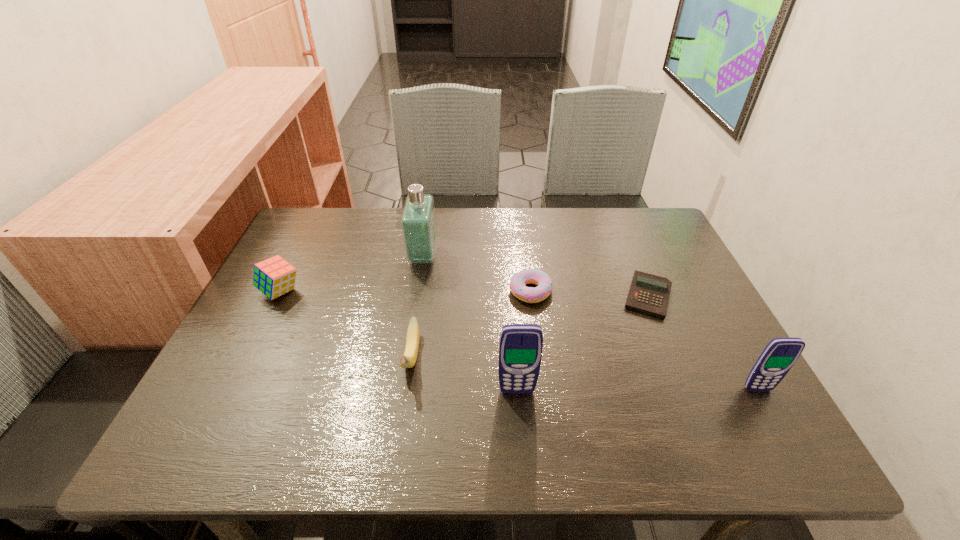
Locate an element on the screen. free space located on the front label of the perfume is located at coordinates (519, 257).

At what (x,y) coordinates should I click in order to perform the action: click on vacant area located 0.120m on the front of the cube. Please return your answer as a coordinate pair (x, y). The width and height of the screenshot is (960, 540). Looking at the image, I should click on (255, 342).

This screenshot has width=960, height=540. Identify the location of vacant space located 0.090m on the right of the doughnut. (588, 292).

In order to click on free space located on the back of the calculator in this screenshot , I will do `click(623, 237)`.

This screenshot has height=540, width=960. I want to click on object at the far edge, so click(x=418, y=222).

At what (x,y) coordinates should I click in order to perform the action: click on banana located in the near edge section of the desktop. Please return your answer as a coordinate pair (x, y). This screenshot has height=540, width=960. Looking at the image, I should click on (408, 360).

Where is `object that is positioned at the left edge`? The image size is (960, 540). object that is positioned at the left edge is located at coordinates (274, 277).

Identify the location of cellular telephone that is at the right edge. (780, 354).

At what (x,y) coordinates should I click in order to perform the action: click on calculator situated at the right edge. Please return your answer as a coordinate pair (x, y). This screenshot has width=960, height=540. Looking at the image, I should click on (649, 294).

I want to click on object that is positioned at the near right corner, so [x=780, y=354].